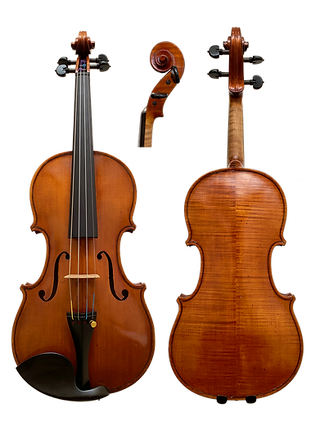
Where is `knob`? Image resolution: width=320 pixels, height=430 pixels. knob is located at coordinates (214, 74).